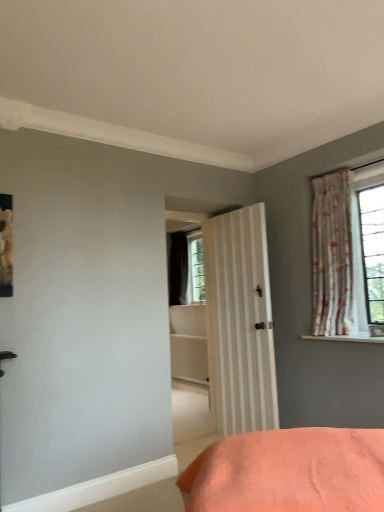
Question: Does white textured shelf at upper right come in front of floral fabric curtain at right?

Choices:
 (A) yes
 (B) no

Answer: (A)

Question: Could you tell me if white textured shelf at upper right is facing floral fabric curtain at right?

Choices:
 (A) yes
 (B) no

Answer: (B)

Question: Is white textured shelf at upper right at the right side of floral fabric curtain at right?

Choices:
 (A) yes
 (B) no

Answer: (A)

Question: Considering the relative sizes of white textured shelf at upper right and floral fabric curtain at right in the image provided, is white textured shelf at upper right taller than floral fabric curtain at right?

Choices:
 (A) no
 (B) yes

Answer: (A)

Question: Is white textured shelf at upper right wider than floral fabric curtain at right?

Choices:
 (A) no
 (B) yes

Answer: (B)

Question: From the image's perspective, is white textured shelf at upper right on floral fabric curtain at right?

Choices:
 (A) no
 (B) yes

Answer: (A)

Question: Considering the relative sizes of floral fabric curtain at right and white textured shelf at upper right in the image provided, is floral fabric curtain at right bigger than white textured shelf at upper right?

Choices:
 (A) no
 (B) yes

Answer: (B)

Question: Is floral fabric curtain at right not near white textured shelf at upper right?

Choices:
 (A) no
 (B) yes

Answer: (A)

Question: Is floral fabric curtain at right thinner than white textured shelf at upper right?

Choices:
 (A) yes
 (B) no

Answer: (A)

Question: Does floral fabric curtain at right turn towards white textured shelf at upper right?

Choices:
 (A) no
 (B) yes

Answer: (A)

Question: Is floral fabric curtain at right behind white textured shelf at upper right?

Choices:
 (A) yes
 (B) no

Answer: (A)

Question: Does floral fabric curtain at right have a smaller size compared to white textured shelf at upper right?

Choices:
 (A) no
 (B) yes

Answer: (A)

Question: In the image, is white textured shelf at upper right on the left side or the right side of floral fabric curtain at right?

Choices:
 (A) right
 (B) left

Answer: (A)